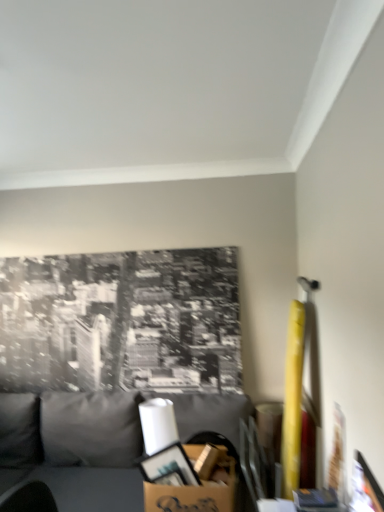
Where is `cardboard box at lower center`? cardboard box at lower center is located at coordinates (197, 490).

The height and width of the screenshot is (512, 384). Describe the element at coordinates (197, 490) in the screenshot. I see `cardboard box at lower center` at that location.

In order to face gray fabric couch at lower left, should I rotate leftwards or rightwards?

Turn left by 7.322 degrees to look at gray fabric couch at lower left.

This screenshot has height=512, width=384. What do you see at coordinates (75, 448) in the screenshot?
I see `gray fabric couch at lower left` at bounding box center [75, 448].

What is the approximate height of gray fabric couch at lower left?

The height of gray fabric couch at lower left is 34.48 inches.

The width and height of the screenshot is (384, 512). In order to click on gray fabric couch at lower left in this screenshot , I will do `click(75, 448)`.

This screenshot has width=384, height=512. Identify the location of cardboard box at lower center. (197, 490).

Which is more to the right, gray fabric couch at lower left or cardboard box at lower center?

Positioned to the right is cardboard box at lower center.

Considering the relative positions of gray fabric couch at lower left and cardboard box at lower center in the image provided, is gray fabric couch at lower left in front of cardboard box at lower center?

Yes, gray fabric couch at lower left is closer to the camera.

Is point (227, 399) less distant than point (180, 494)?

No, (227, 399) is further to viewer.

Consider the image. From the image's perspective, is gray fabric couch at lower left located above or below cardboard box at lower center?

From the image's perspective, gray fabric couch at lower left appears below cardboard box at lower center.

From a real-world perspective, relative to cardboard box at lower center, is gray fabric couch at lower left vertically above or below?

Clearly, from a real-world perspective, gray fabric couch at lower left is below cardboard box at lower center.

In the scene shown: Is gray fabric couch at lower left wider or thinner than cardboard box at lower center?

Considering their sizes, gray fabric couch at lower left looks broader than cardboard box at lower center.

Does gray fabric couch at lower left have a greater height compared to cardboard box at lower center?

Indeed, gray fabric couch at lower left has a greater height compared to cardboard box at lower center.

In terms of size, does gray fabric couch at lower left appear bigger or smaller than cardboard box at lower center?

Clearly, gray fabric couch at lower left is larger in size than cardboard box at lower center.

Could cardboard box at lower center be considered to be inside gray fabric couch at lower left?

Indeed, cardboard box at lower center is located within gray fabric couch at lower left.

Is gray fabric couch at lower left directly adjacent to cardboard box at lower center?

They are not placed beside each other.

From the picture: Could you tell me if gray fabric couch at lower left is facing cardboard box at lower center?

Yes.

Can you tell me how much gray fabric couch at lower left and cardboard box at lower center differ in facing direction?

The angle between the facing direction of gray fabric couch at lower left and the facing direction of cardboard box at lower center is 0.762 degrees.

In order to click on cardboard box on the right of gray fabric couch at lower left in this screenshot , I will do `click(197, 490)`.

Considering the positions of objects cardboard box at lower center and gray fabric couch at lower left in the image provided, who is more to the left, cardboard box at lower center or gray fabric couch at lower left?

From the viewer's perspective, gray fabric couch at lower left appears more on the left side.

Considering the positions of objects cardboard box at lower center and gray fabric couch at lower left in the image provided, who is behind, cardboard box at lower center or gray fabric couch at lower left?

cardboard box at lower center is behind.

Does point (196, 506) come in front of point (187, 423)?

That is True.

From the image's perspective, between cardboard box at lower center and gray fabric couch at lower left, who is located below?

gray fabric couch at lower left.

Consider the image. From a real-world perspective, is cardboard box at lower center positioned over gray fabric couch at lower left based on gravity?

Yes, from a real-world perspective, cardboard box at lower center is on top of gray fabric couch at lower left.

Considering the sizes of objects cardboard box at lower center and gray fabric couch at lower left in the image provided, who is wider, cardboard box at lower center or gray fabric couch at lower left?

gray fabric couch at lower left.

Considering the relative sizes of cardboard box at lower center and gray fabric couch at lower left in the image provided, is cardboard box at lower center shorter than gray fabric couch at lower left?

Yes.

Is cardboard box at lower center smaller than gray fabric couch at lower left?

Yes.

Is cardboard box at lower center not within gray fabric couch at lower left?

No.

Is cardboard box at lower center directly adjacent to gray fabric couch at lower left?

cardboard box at lower center and gray fabric couch at lower left are clearly separated.

Could you tell me if cardboard box at lower center is facing gray fabric couch at lower left?

Yes, cardboard box at lower center is oriented towards gray fabric couch at lower left.

This screenshot has height=512, width=384. Find the location of `studio couch lying in front of the cardboard box at lower center`. studio couch lying in front of the cardboard box at lower center is located at coordinates (75, 448).

Locate an element on the screen. studio couch below the cardboard box at lower center (from the image's perspective) is located at coordinates (75, 448).

Find the location of a particular element. This screenshot has height=512, width=384. cardboard box located behind the gray fabric couch at lower left is located at coordinates (197, 490).